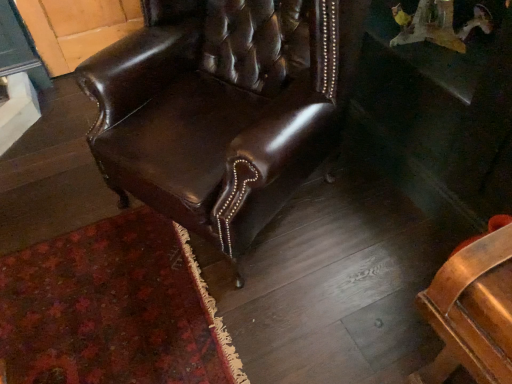
What do you see at coordinates (222, 108) in the screenshot? I see `shiny brown leather chair at center` at bounding box center [222, 108].

Image resolution: width=512 pixels, height=384 pixels. Identify the location of shiny brown leather chair at center. (222, 108).

Where is `shiny brown leather chair at center`? This screenshot has height=384, width=512. shiny brown leather chair at center is located at coordinates (222, 108).